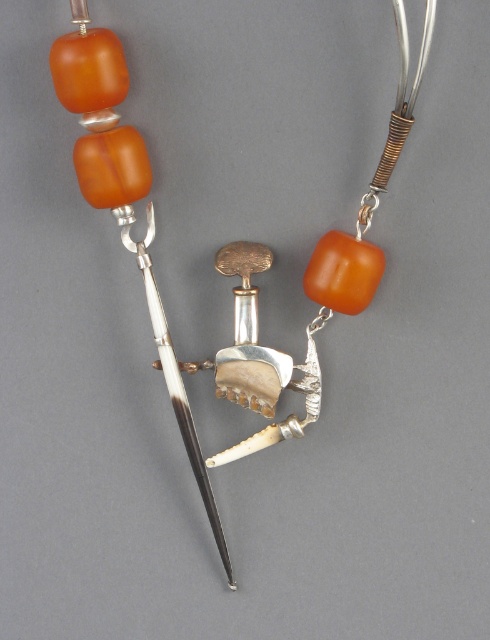
Who is lower down, matte orange glass beads at upper center or matte orange bead at upper left?

Positioned lower is matte orange bead at upper left.

Is matte orange glass beads at upper center shorter than matte orange bead at upper left?

Incorrect, matte orange glass beads at upper center's height does not fall short of matte orange bead at upper left's.

The height and width of the screenshot is (640, 490). Identify the location of matte orange glass beads at upper center. (225, 244).

Image resolution: width=490 pixels, height=640 pixels. Identify the location of matte orange glass beads at upper center. point(225,244).